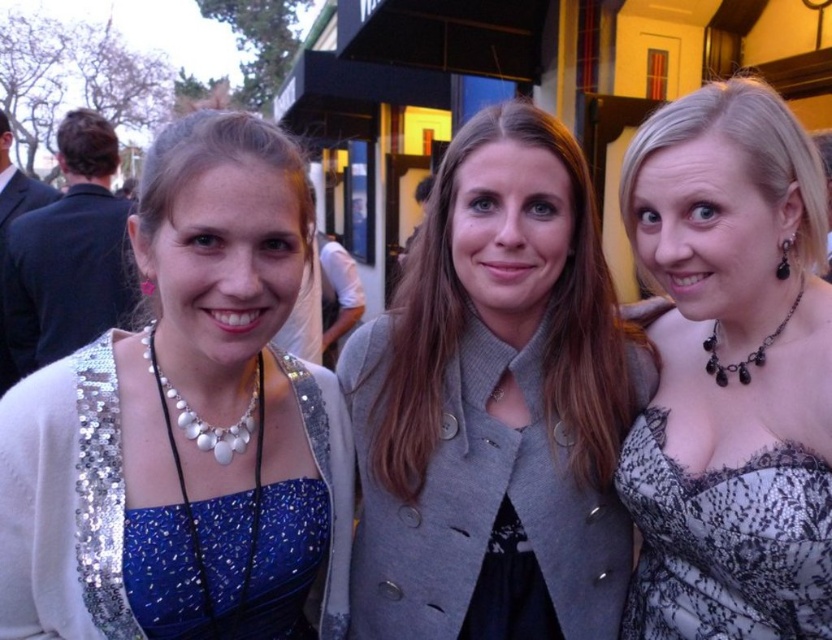
Question: Does satin blue dress at center have a lesser width compared to black beaded necklace at right?

Choices:
 (A) no
 (B) yes

Answer: (A)

Question: Does blue sequined dress at left appear under white pearl necklace at center?

Choices:
 (A) yes
 (B) no

Answer: (A)

Question: Which point is farther from the camera taking this photo?

Choices:
 (A) (82, 529)
 (B) (187, 417)
 (C) (716, 344)
 (D) (644, 417)

Answer: (D)

Question: Does satin blue dress at center appear on the right side of black lace dress at right?

Choices:
 (A) no
 (B) yes

Answer: (A)

Question: Estimate the real-world distances between objects in this image. Which object is closer to the satin blue dress at center?

Choices:
 (A) white pearl necklace at center
 (B) black lace dress at center
 (C) black beaded necklace at right

Answer: (A)

Question: Which object is closer to the camera taking this photo?

Choices:
 (A) blue sequined dress at left
 (B) black lace dress at right

Answer: (A)